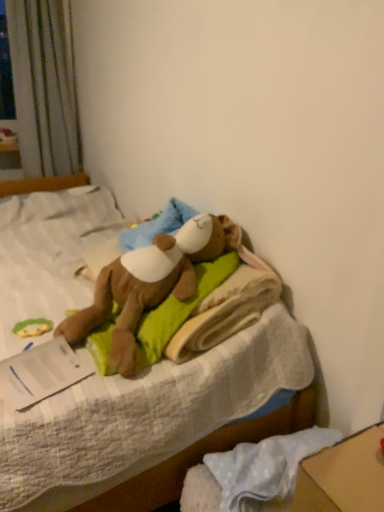
Question: From a real-world perspective, does green fabric toy at lower left sit lower than soft plush bear at center?

Choices:
 (A) no
 (B) yes

Answer: (A)

Question: Does green fabric toy at lower left contain soft plush bear at center?

Choices:
 (A) yes
 (B) no

Answer: (B)

Question: Considering the relative positions of green fabric toy at lower left and soft plush bear at center in the image provided, is green fabric toy at lower left to the left of soft plush bear at center from the viewer's perspective?

Choices:
 (A) yes
 (B) no

Answer: (B)

Question: Is green fabric toy at lower left completely or partially outside of soft plush bear at center?

Choices:
 (A) no
 (B) yes

Answer: (A)

Question: Considering the relative sizes of green fabric toy at lower left and soft plush bear at center in the image provided, is green fabric toy at lower left smaller than soft plush bear at center?

Choices:
 (A) no
 (B) yes

Answer: (B)

Question: Does green fabric toy at lower left come behind soft plush bear at center?

Choices:
 (A) yes
 (B) no

Answer: (A)

Question: From the image's perspective, is soft plush bear at center under green fabric toy at lower left?

Choices:
 (A) no
 (B) yes

Answer: (A)

Question: Is soft plush bear at center further to camera compared to green fabric toy at lower left?

Choices:
 (A) yes
 (B) no

Answer: (B)

Question: Is soft plush bear at center shorter than green fabric toy at lower left?

Choices:
 (A) yes
 (B) no

Answer: (B)

Question: From the image's perspective, would you say soft plush bear at center is positioned over green fabric toy at lower left?

Choices:
 (A) no
 (B) yes

Answer: (B)

Question: Is soft plush bear at center in contact with green fabric toy at lower left?

Choices:
 (A) yes
 (B) no

Answer: (B)

Question: From a real-world perspective, is soft plush bear at center beneath green fabric toy at lower left?

Choices:
 (A) no
 (B) yes

Answer: (B)

Question: Visually, is green fabric toy at lower left positioned to the left or to the right of soft plush bear at center?

Choices:
 (A) right
 (B) left

Answer: (A)